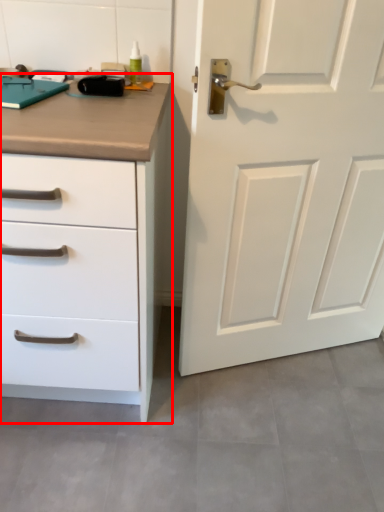
Question: From the image, what is the correct spatial relationship of chest of drawers (annotated by the red box) in relation to door?

Choices:
 (A) left
 (B) right

Answer: (A)